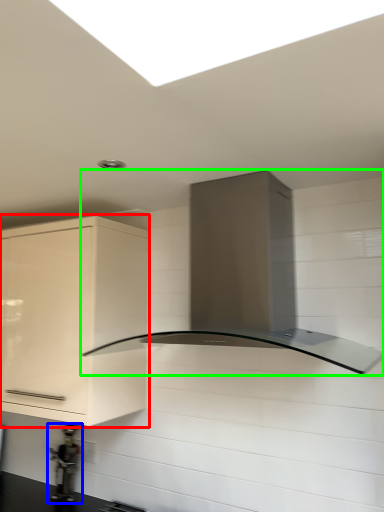
Question: Which object is positioned closest to cabinetry (highlighted by a red box)? Select from appliance (highlighted by a blue box) and home appliance (highlighted by a green box).

Choices:
 (A) appliance
 (B) home appliance

Answer: (B)